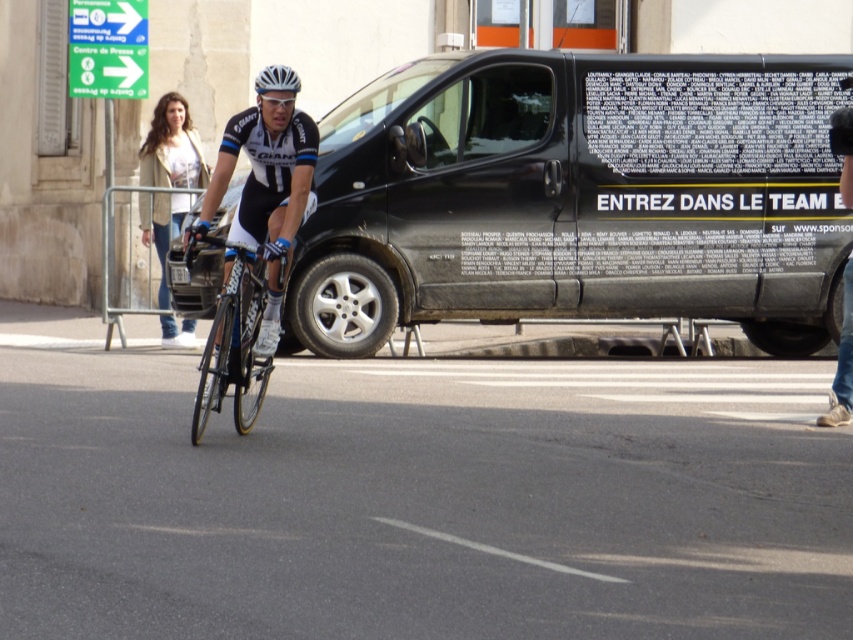
Question: Is shiny blue frame at center to the left of denim jeans at center from the viewer's perspective?

Choices:
 (A) yes
 (B) no

Answer: (A)

Question: Can you confirm if denim jeans at center is positioned below white matte bicycle helmet at center?

Choices:
 (A) no
 (B) yes

Answer: (B)

Question: Which of the following is the farthest from the observer?

Choices:
 (A) white matte bicycle helmet at center
 (B) black matte van at center
 (C) denim jeans at center
 (D) black matte cycling jersey at center

Answer: (B)

Question: Which of these objects is positioned farthest from the black matte van at center?

Choices:
 (A) black matte cycling jersey at center
 (B) white matte helmet at center

Answer: (B)

Question: Among these points, which one is farthest from the camera?

Choices:
 (A) (259, 92)
 (B) (567, 228)
 (C) (848, 333)
 (D) (180, 204)

Answer: (D)

Question: Is shiny blue frame at center to the right of denim jacket at left from the viewer's perspective?

Choices:
 (A) no
 (B) yes

Answer: (B)